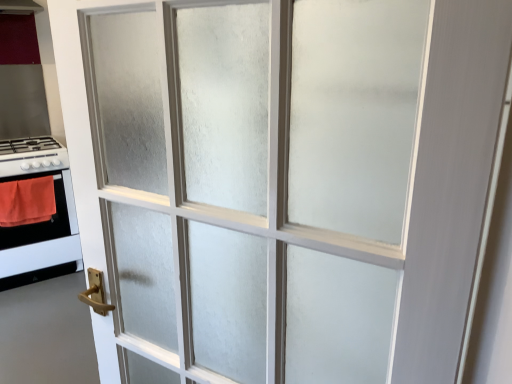
This screenshot has height=384, width=512. What do you see at coordinates (47, 333) in the screenshot?
I see `wooden handle at lower left` at bounding box center [47, 333].

This screenshot has width=512, height=384. Describe the element at coordinates (31, 156) in the screenshot. I see `white glossy gas stove at left` at that location.

This screenshot has height=384, width=512. What do you see at coordinates (27, 201) in the screenshot?
I see `orange fabric at left` at bounding box center [27, 201].

Locate an element on the screen. white glossy stove at left is located at coordinates (39, 222).

Would you say wooden handle at lower left is outside orange fabric at left?

Yes, wooden handle at lower left is not within orange fabric at left.

Can you tell me how much wooden handle at lower left and orange fabric at left differ in facing direction?

The angular difference between wooden handle at lower left and orange fabric at left is 0.634 degrees.

Locate an element on the screen. door to the right of orange fabric at left is located at coordinates (47, 333).

Does wooden handle at lower left lie behind orange fabric at left?

No, wooden handle at lower left is closer to the viewer.

Is white glossy gas stove at left turned away from white glossy stove at left?

No, white glossy stove at left is not at the back of white glossy gas stove at left.

Between white glossy gas stove at left and white glossy stove at left, which one has larger size?

white glossy stove at left.

Does white glossy gas stove at left touch white glossy stove at left?

There is a gap between white glossy gas stove at left and white glossy stove at left.

Based on the photo, does white glossy gas stove at left have a greater width compared to white glossy stove at left?

Yes.

Does white glossy stove at left have a lesser width compared to white glossy gas stove at left?

Yes.

Which object is closer to the camera taking this photo, white glossy stove at left or white glossy gas stove at left?

white glossy stove at left is more forward.

Is white glossy stove at left to the left of white glossy gas stove at left from the viewer's perspective?

Yes, white glossy stove at left is to the left of white glossy gas stove at left.

Consider the image. Is white glossy gas stove at left at the back of white glossy stove at left?

white glossy stove at left does not have its back to white glossy gas stove at left.

Where is `blanket above the white glossy stove at left (from the image's perspective)`? blanket above the white glossy stove at left (from the image's perspective) is located at coordinates (27, 201).

Could you tell me if white glossy stove at left is turned towards orange fabric at left?

Yes, white glossy stove at left is facing orange fabric at left.

Between white glossy stove at left and orange fabric at left, which one is positioned behind?

orange fabric at left is behind.

From the picture: Which object is positioned more to the right, white glossy gas stove at left or orange fabric at left?

From the viewer's perspective, orange fabric at left appears more on the right side.

Is white glossy gas stove at left not inside orange fabric at left?

Yes.

Between point (36, 160) and point (49, 199), which one is positioned behind?

Positioned behind is point (49, 199).

Who is more distant, orange fabric at left or white glossy gas stove at left?

white glossy gas stove at left is further away from the camera.

From a real-world perspective, is orange fabric at left physically below white glossy gas stove at left?

Correct, in the physical world, orange fabric at left is lower than white glossy gas stove at left.

Is orange fabric at left completely or partially outside of white glossy gas stove at left?

Yes.

From the image's perspective, is white glossy stove at left beneath wooden handle at lower left?

Incorrect, from the image's perspective, white glossy stove at left is higher than wooden handle at lower left.

Between white glossy stove at left and wooden handle at lower left, which one is positioned in front?

wooden handle at lower left is more forward.

Considering the positions of point (5, 239) and point (76, 362), is point (5, 239) closer or farther from the camera than point (76, 362)?

Point (5, 239) is farther from the camera than point (76, 362).

Locate an element on the screen. The width and height of the screenshot is (512, 384). door on the right of the orange fabric at left is located at coordinates (47, 333).

Identify the location of appliance on the left side of white glossy gas stove at left. (39, 222).

Estimate the real-world distances between objects in this image. Which object is further from white glossy gas stove at left, white glossy stove at left or wooden handle at lower left?

wooden handle at lower left lies further to white glossy gas stove at left than the other object.

Which object lies nearer to the anchor point white glossy gas stove at left, wooden handle at lower left or white glossy stove at left?

white glossy stove at left lies closer to white glossy gas stove at left than the other object.

Based on the photo, considering their positions, is white glossy gas stove at left positioned further to white glossy stove at left than wooden handle at lower left?

The object further to white glossy stove at left is wooden handle at lower left.

Estimate the real-world distances between objects in this image. Which object is closer to white glossy stove at left, white glossy gas stove at left or orange fabric at left?

The object closer to white glossy stove at left is orange fabric at left.

Looking at the image, which one is located closer to orange fabric at left, wooden handle at lower left or white glossy stove at left?

white glossy stove at left is positioned closer to the anchor orange fabric at left.

Considering their positions, is wooden handle at lower left positioned further to white glossy gas stove at left than orange fabric at left?

wooden handle at lower left lies further to white glossy gas stove at left than the other object.

Estimate the real-world distances between objects in this image. Which object is further from wooden handle at lower left, orange fabric at left or white glossy stove at left?

orange fabric at left lies further to wooden handle at lower left than the other object.

Considering their positions, is white glossy stove at left positioned closer to orange fabric at left than wooden handle at lower left?

Among the two, white glossy stove at left is located nearer to orange fabric at left.

At what (x,y) coordinates should I click in order to perform the action: click on blanket between white glossy gas stove at left and white glossy stove at left in the up-down direction. Please return your answer as a coordinate pair (x, y). This screenshot has width=512, height=384. Looking at the image, I should click on (27, 201).

I want to click on appliance between white glossy gas stove at left and wooden handle at lower left vertically, so click(x=39, y=222).

The width and height of the screenshot is (512, 384). Find the location of `appliance between wooden handle at lower left and orange fabric at left from front to back`. appliance between wooden handle at lower left and orange fabric at left from front to back is located at coordinates (39, 222).

Where is `blanket that lies between white glossy gas stove at left and wooden handle at lower left from top to bottom`? blanket that lies between white glossy gas stove at left and wooden handle at lower left from top to bottom is located at coordinates (27, 201).